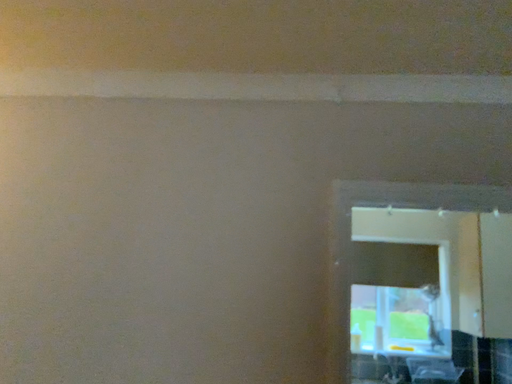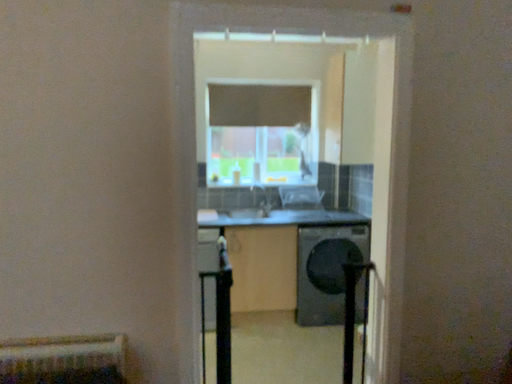
Question: How did the camera likely rotate when shooting the video?

Choices:
 (A) rotated downward
 (B) rotated upward

Answer: (A)